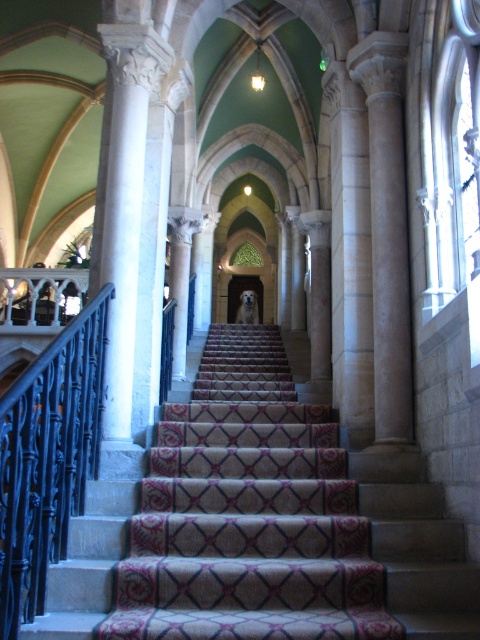
You are standing at the entrance of the staircase and want to reach the black wrought iron railing at left. According to the coordinates provided, where exactly is the railing positioned in the image?

The black wrought iron railing at left is located at point coordinates of 0.716 on the x axis and 0.100 on the y axis.

You are a painter needing to reach the top of the carpeted stairs at center to touch up some paint. You have a ladder that is 1.5 meters tall. The black wrought iron railing at left is in your way. Can you safely climb the ladder to reach the stairs without hitting the railing?

The carpeted stairs at center is positioned under the black wrought iron railing at left, so the railing is above the stairs. Since the railing is above, you can safely climb the ladder to reach the carpeted stairs at center without hitting the railing. However, ensure the ladder is placed securely on the stairs.